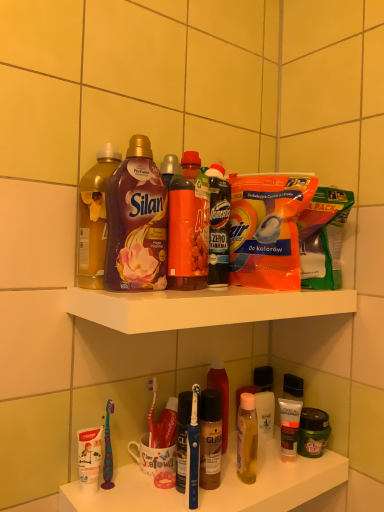
The width and height of the screenshot is (384, 512). Identify the location of free space on the front side of purple glossy liquid at upper center, which appears as the 2th bottle when viewed from the right. (141, 293).